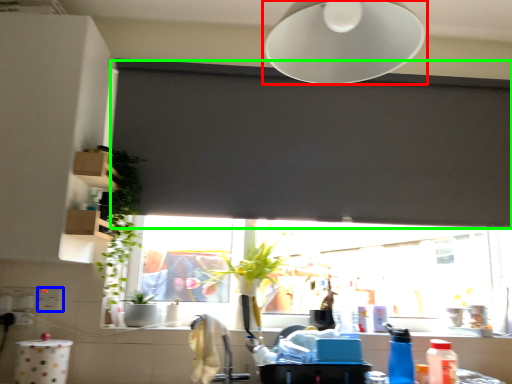
Question: Which is farther away from lamp (highlighted by a red box)? electric outlet (highlighted by a blue box) or window screen (highlighted by a green box)?

Choices:
 (A) electric outlet
 (B) window screen

Answer: (A)